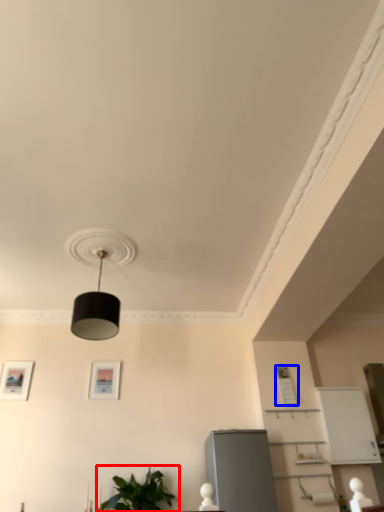
Question: Which object is further to the camera taking this photo, houseplant (highlighted by a red box) or picture frame (highlighted by a blue box)?

Choices:
 (A) houseplant
 (B) picture frame

Answer: (B)